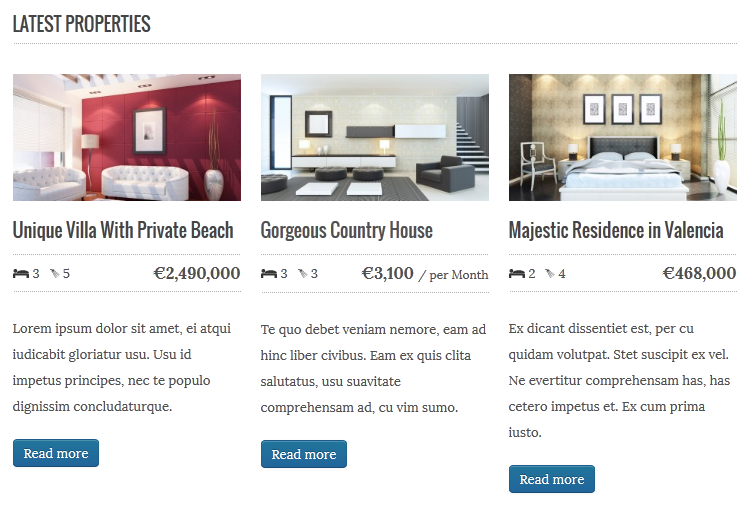
Locate an element on the screen. Image resolution: width=754 pixels, height=520 pixels. number of bedrooms is located at coordinates (17, 271), (274, 276), (512, 275).